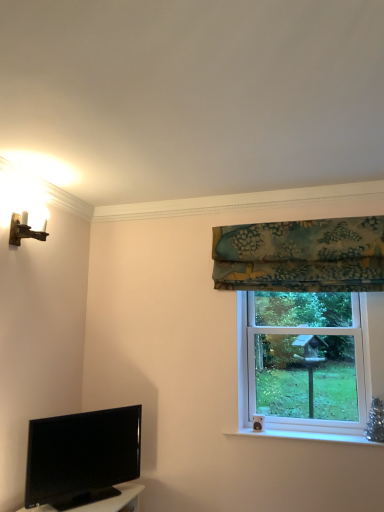
Question: Is teal floral fabric at upper right behind clear glass window at right?

Choices:
 (A) no
 (B) yes

Answer: (A)

Question: Is clear glass window at right at the back of teal floral fabric at upper right?

Choices:
 (A) no
 (B) yes

Answer: (A)

Question: Considering the relative sizes of teal floral fabric at upper right and clear glass window at right in the image provided, is teal floral fabric at upper right taller than clear glass window at right?

Choices:
 (A) no
 (B) yes

Answer: (A)

Question: Is teal floral fabric at upper right oriented towards clear glass window at right?

Choices:
 (A) no
 (B) yes

Answer: (A)

Question: Can you confirm if teal floral fabric at upper right is thinner than clear glass window at right?

Choices:
 (A) no
 (B) yes

Answer: (B)

Question: Can you confirm if teal floral fabric at upper right is bigger than clear glass window at right?

Choices:
 (A) no
 (B) yes

Answer: (A)

Question: Is clear glass window at right positioned beyond the bounds of teal floral fabric at upper right?

Choices:
 (A) no
 (B) yes

Answer: (B)

Question: Does clear glass window at right touch teal floral fabric at upper right?

Choices:
 (A) yes
 (B) no

Answer: (B)

Question: Considering the relative positions of clear glass window at right and teal floral fabric at upper right in the image provided, is clear glass window at right in front of teal floral fabric at upper right?

Choices:
 (A) yes
 (B) no

Answer: (B)

Question: From the image's perspective, is clear glass window at right beneath teal floral fabric at upper right?

Choices:
 (A) no
 (B) yes

Answer: (B)

Question: Can you confirm if clear glass window at right is positioned to the left of teal floral fabric at upper right?

Choices:
 (A) no
 (B) yes

Answer: (A)

Question: Would you say clear glass window at right is a long distance from teal floral fabric at upper right?

Choices:
 (A) yes
 (B) no

Answer: (B)

Question: Does wooden wall sconce at upper left turn towards clear glass window at right?

Choices:
 (A) no
 (B) yes

Answer: (A)